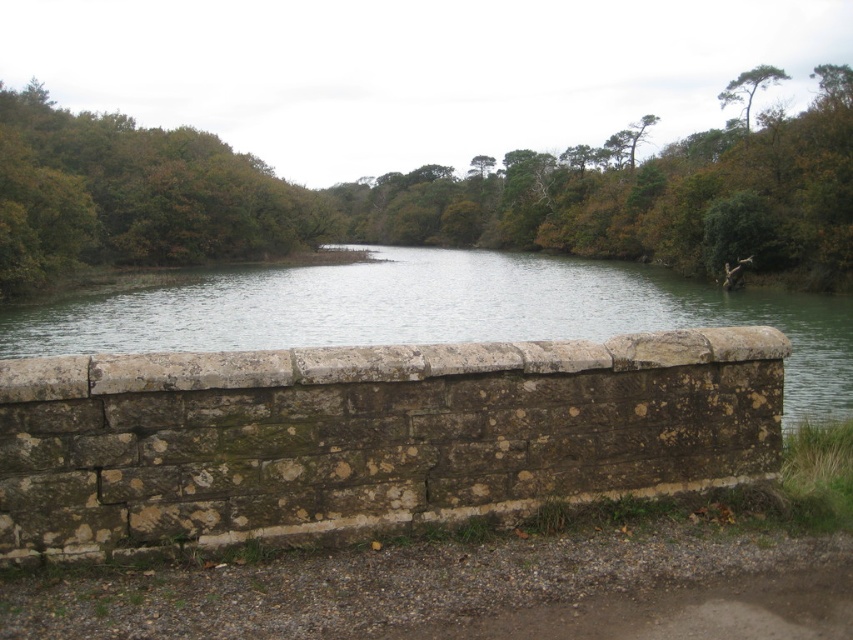
Question: Among these objects, which one is farthest from the camera?

Choices:
 (A) greenish stone river at center
 (B) green leafy tree at center

Answer: (B)

Question: Can you confirm if green leafy tree at center is thinner than greenish stone river at center?

Choices:
 (A) yes
 (B) no

Answer: (B)

Question: Observing the image, what is the correct spatial positioning of green leafy tree at center in reference to greenish stone river at center?

Choices:
 (A) right
 (B) left

Answer: (B)

Question: Can you confirm if green leafy tree at center is smaller than green textured tree at upper right?

Choices:
 (A) yes
 (B) no

Answer: (A)

Question: Which of these objects is positioned closest to the greenish stone river at center?

Choices:
 (A) green textured tree at upper right
 (B) green leafy tree at center

Answer: (B)

Question: Which of these objects is positioned closest to the green leafy tree at center?

Choices:
 (A) greenish stone river at center
 (B) green textured tree at upper right

Answer: (A)